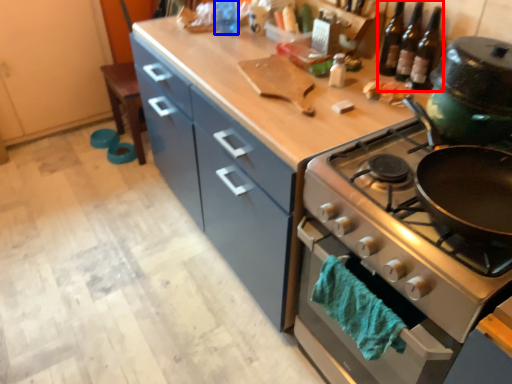
Question: Which of the following is the farthest to the observer, wine bottle (highlighted by a red box) or bottle (highlighted by a blue box)?

Choices:
 (A) wine bottle
 (B) bottle

Answer: (B)